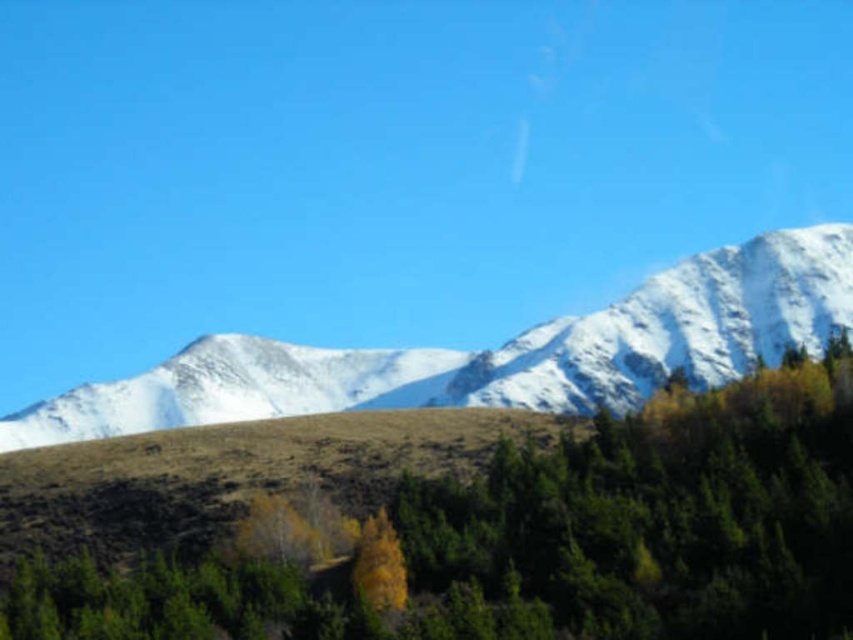
Between white snow-covered mountain range at center and white snow-covered mountain at upper right, which one has less height?

With less height is white snow-covered mountain at upper right.

Can you confirm if white snow-covered mountain range at center is wider than white snow-covered mountain at upper right?

Yes, white snow-covered mountain range at center is wider than white snow-covered mountain at upper right.

At what (x,y) coordinates should I click in order to perform the action: click on white snow-covered mountain range at center. Please return your answer as a coordinate pair (x, y). Looking at the image, I should click on (497, 353).

Is point (747, 497) farther from camera compared to point (506, 342)?

No.

Who is more distant from viewer, (772, 518) or (337, 385)?

Point (337, 385)

Find the location of a particular element. The width and height of the screenshot is (853, 640). yellow-green leafy tree at center is located at coordinates (540, 540).

Does yellow-green leafy tree at center have a larger size compared to white snow-covered mountain at upper right?

No, yellow-green leafy tree at center is not bigger than white snow-covered mountain at upper right.

From the picture: Who is shorter, yellow-green leafy tree at center or white snow-covered mountain at upper right?

With less height is yellow-green leafy tree at center.

Describe the element at coordinates (540, 540) in the screenshot. I see `yellow-green leafy tree at center` at that location.

The image size is (853, 640). I want to click on yellow-green leafy tree at center, so click(540, 540).